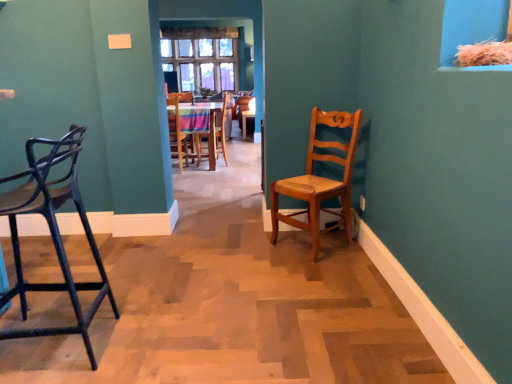
This screenshot has height=384, width=512. Identify the location of vacant space in light brown wooden chair at center, which is counted as the 2th chair, starting from the front (from a real-world perspective). (317, 240).